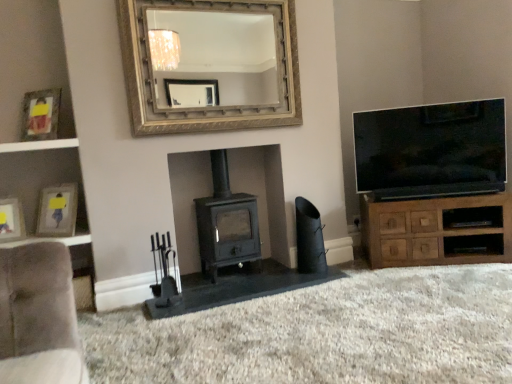
Question: Can you confirm if brown wood cabinet at right is wider than matte black fireplace tools at center?

Choices:
 (A) yes
 (B) no

Answer: (B)

Question: Is brown wood cabinet at right positioned before matte black fireplace tools at center?

Choices:
 (A) no
 (B) yes

Answer: (A)

Question: Considering the relative sizes of brown wood cabinet at right and matte black fireplace tools at center in the image provided, is brown wood cabinet at right taller than matte black fireplace tools at center?

Choices:
 (A) no
 (B) yes

Answer: (B)

Question: Does brown wood cabinet at right have a smaller size compared to matte black fireplace tools at center?

Choices:
 (A) no
 (B) yes

Answer: (B)

Question: Is matte black fireplace tools at center at the back of brown wood cabinet at right?

Choices:
 (A) no
 (B) yes

Answer: (A)

Question: Is brown wood cabinet at right to the left of matte black fireplace tools at center from the viewer's perspective?

Choices:
 (A) yes
 (B) no

Answer: (B)

Question: Could you tell me if matte gold picture frame at upper left, placed as the first picture frame when sorted from top to bottom, is facing matte black wood burning stove at center?

Choices:
 (A) no
 (B) yes

Answer: (A)

Question: From a real-world perspective, is matte gold picture frame at upper left, placed as the first picture frame when sorted from top to bottom, physically above matte black wood burning stove at center?

Choices:
 (A) no
 (B) yes

Answer: (B)

Question: Is matte gold picture frame at upper left, placed as the first picture frame when sorted from top to bottom, to the right of matte black wood burning stove at center from the viewer's perspective?

Choices:
 (A) no
 (B) yes

Answer: (A)

Question: Is matte gold picture frame at upper left, the third picture frame in the bottom-to-top sequence, not within matte black wood burning stove at center?

Choices:
 (A) yes
 (B) no

Answer: (A)

Question: Is matte gold picture frame at upper left, placed as the first picture frame when sorted from top to bottom, to the left of matte black wood burning stove at center from the viewer's perspective?

Choices:
 (A) no
 (B) yes

Answer: (B)

Question: From a real-world perspective, is matte gold picture frame at upper left, placed as the first picture frame when sorted from top to bottom, under matte black wood burning stove at center?

Choices:
 (A) no
 (B) yes

Answer: (A)

Question: From the image's perspective, is matte black wood burning stove at center above matte gold picture frame at upper left, placed as the first picture frame when sorted from top to bottom?

Choices:
 (A) yes
 (B) no

Answer: (B)